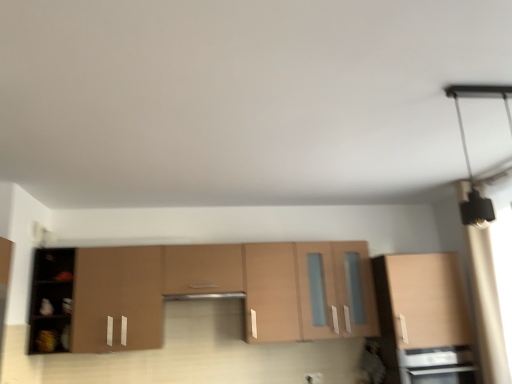
Question: Is matte black oven at lower right behind matte brown cabinet at center, placed as the first cabinetry when sorted from left to right?

Choices:
 (A) yes
 (B) no

Answer: (B)

Question: Can you confirm if matte black oven at lower right is bigger than matte brown cabinet at center, which is the 2th cabinetry from right to left?

Choices:
 (A) no
 (B) yes

Answer: (A)

Question: Does matte black oven at lower right touch matte brown cabinet at center, which is the 2th cabinetry from right to left?

Choices:
 (A) yes
 (B) no

Answer: (B)

Question: Is matte black oven at lower right outside of matte brown cabinet at center, which is the 2th cabinetry from right to left?

Choices:
 (A) yes
 (B) no

Answer: (A)

Question: Considering the relative sizes of matte black oven at lower right and matte brown cabinet at center, which is the 2th cabinetry from right to left, in the image provided, is matte black oven at lower right smaller than matte brown cabinet at center, which is the 2th cabinetry from right to left,?

Choices:
 (A) no
 (B) yes

Answer: (B)

Question: From the image's perspective, is matte black oven at lower right on top of matte brown cabinet at center, which is the 2th cabinetry from right to left?

Choices:
 (A) no
 (B) yes

Answer: (A)

Question: Is satin silver exhaust hood at center shorter than matte black oven at lower right?

Choices:
 (A) no
 (B) yes

Answer: (B)

Question: From a real-world perspective, is satin silver exhaust hood at center on matte black oven at lower right?

Choices:
 (A) no
 (B) yes

Answer: (B)

Question: Does satin silver exhaust hood at center have a greater height compared to matte black oven at lower right?

Choices:
 (A) yes
 (B) no

Answer: (B)

Question: Is satin silver exhaust hood at center bigger than matte black oven at lower right?

Choices:
 (A) yes
 (B) no

Answer: (B)

Question: Is satin silver exhaust hood at center thinner than matte black oven at lower right?

Choices:
 (A) yes
 (B) no

Answer: (A)

Question: Does satin silver exhaust hood at center have a greater width compared to matte black oven at lower right?

Choices:
 (A) no
 (B) yes

Answer: (A)

Question: Does matte brown cabinet at center, which is the 2th cabinetry from right to left, have a greater height compared to matte wood cabinet at right, acting as the 1th cabinetry starting from the right?

Choices:
 (A) no
 (B) yes

Answer: (B)